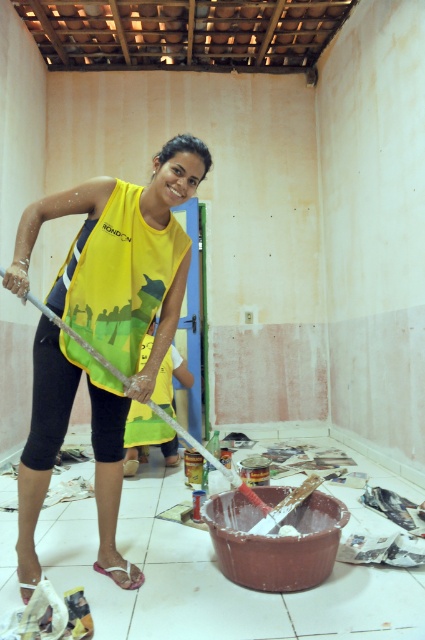
Who is positioned more to the left, yellow fabric at center or white plastic shovel at center?

yellow fabric at center is more to the left.

Describe the element at coordinates (102, 330) in the screenshot. I see `yellow fabric at center` at that location.

This screenshot has width=425, height=640. Identify the location of yellow fabric at center. (102, 330).